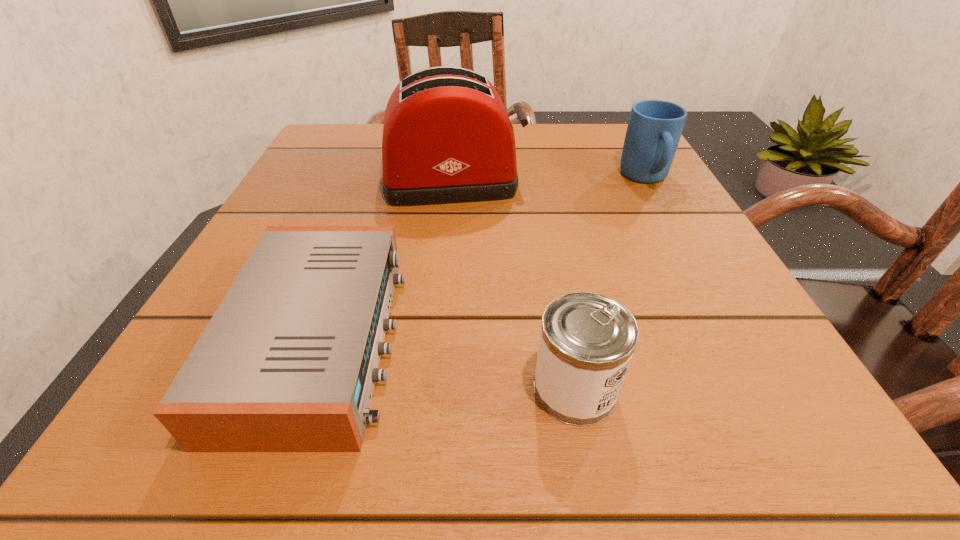
Identify the location of free spot that satisfies the following two spatial constraints: 1. on the front panel of the shortest object; 2. on the right side of the can. [x=303, y=389].

Image resolution: width=960 pixels, height=540 pixels. Find the location of `free space that satisfies the following two spatial constraints: 1. on the front panel of the radio receiver; 2. on the right side of the third tallest object`. free space that satisfies the following two spatial constraints: 1. on the front panel of the radio receiver; 2. on the right side of the third tallest object is located at coordinates (303, 389).

Image resolution: width=960 pixels, height=540 pixels. In order to click on free space that satisfies the following two spatial constraints: 1. on the front panel of the shortest object; 2. on the right side of the can in this screenshot , I will do `click(303, 389)`.

You are a GUI agent. You are given a task and a screenshot of the screen. Output one action in this format:
    pyautogui.click(x=<x>, y=<y>)
    Task: Click on the vacant region that satisfies the following two spatial constraints: 1. on the front panel of the radio receiver; 2. on the left side of the second shortest object
    This screenshot has width=960, height=540.
    Given the screenshot: What is the action you would take?
    pyautogui.click(x=303, y=389)